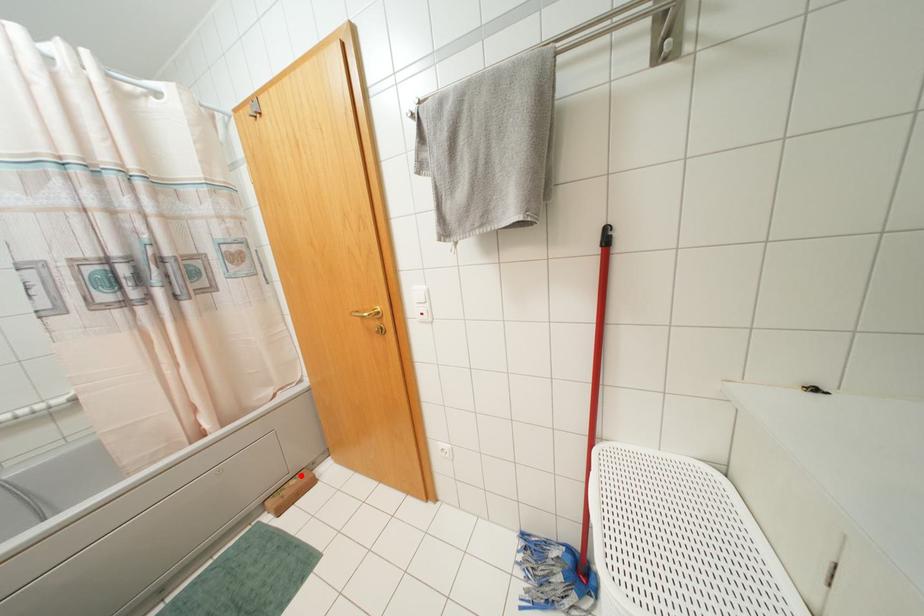
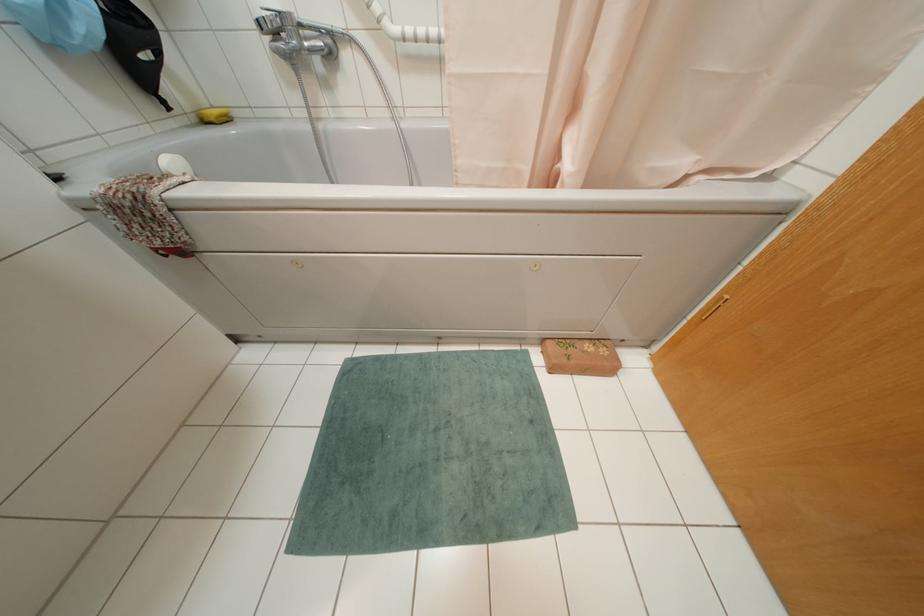
Question: I am providing you with two images of the same scene from different viewpoints. A red point is shown in image1. For the corresponding object point in image2, is it positioned nearer or farther from the camera?

Choices:
 (A) Nearer
 (B) Farther

Answer: (B)